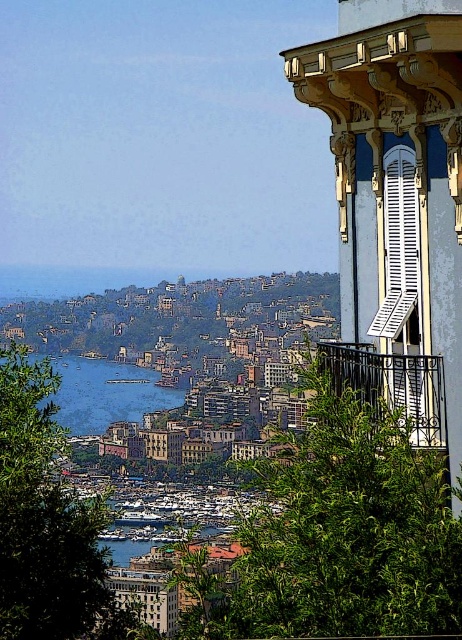
Question: Is the position of green leafy tree at center more distant than that of white matte shutter at upper right?

Choices:
 (A) no
 (B) yes

Answer: (A)

Question: Which of the following is the farthest from the observer?

Choices:
 (A) (418, 208)
 (B) (47, 524)
 (C) (144, 384)
 (D) (459, 596)

Answer: (C)

Question: Considering the relative positions of green leafy tree at lower left and blue water at center in the image provided, where is green leafy tree at lower left located with respect to blue water at center?

Choices:
 (A) left
 (B) right

Answer: (B)

Question: Does green leafy tree at center appear on the left side of blue water at center?

Choices:
 (A) no
 (B) yes

Answer: (A)

Question: Which point is closer to the camera?

Choices:
 (A) green leafy tree at center
 (B) black wrought iron balcony at upper right
 (C) green leafy tree at lower left
 (D) white matte shutter at upper right

Answer: (B)

Question: Which of these objects is positioned closest to the green leafy tree at lower left?

Choices:
 (A) black wrought iron balcony at upper right
 (B) green leafy tree at center
 (C) blue water at center

Answer: (B)